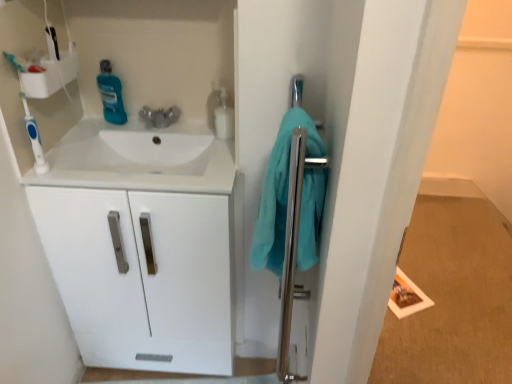
Question: Is blue plastic toothbrush at left wider than teal fabric towel at right?

Choices:
 (A) yes
 (B) no

Answer: (B)

Question: Is blue plastic toothbrush at left oriented away from teal fabric towel at right?

Choices:
 (A) no
 (B) yes

Answer: (A)

Question: Can you confirm if blue plastic toothbrush at left is thinner than teal fabric towel at right?

Choices:
 (A) yes
 (B) no

Answer: (A)

Question: Is blue plastic toothbrush at left positioned beyond the bounds of teal fabric towel at right?

Choices:
 (A) yes
 (B) no

Answer: (A)

Question: Does blue plastic toothbrush at left turn towards teal fabric towel at right?

Choices:
 (A) yes
 (B) no

Answer: (B)

Question: Considering the positions of white glossy sink at upper left and teal glossy mouthwash at upper left, the second cleaning product from the right, in the image, is white glossy sink at upper left bigger or smaller than teal glossy mouthwash at upper left, the second cleaning product from the right,?

Choices:
 (A) small
 (B) big

Answer: (B)

Question: Which is correct: white glossy sink at upper left is inside teal glossy mouthwash at upper left, the second cleaning product from the right, or outside of it?

Choices:
 (A) outside
 (B) inside

Answer: (A)

Question: In the image, is white glossy sink at upper left on the left side or the right side of teal glossy mouthwash at upper left, the 1th cleaning product when ordered from left to right?

Choices:
 (A) right
 (B) left

Answer: (A)

Question: Does point pyautogui.click(x=193, y=157) appear closer or farther from the camera than point pyautogui.click(x=120, y=107)?

Choices:
 (A) farther
 (B) closer

Answer: (B)

Question: Looking at their shapes, would you say teal glossy mouthwash at upper left, the 1th cleaning product when ordered from left to right, is wider or thinner than blue plastic toothbrush at left?

Choices:
 (A) thin
 (B) wide

Answer: (B)

Question: From the image's perspective, relative to blue plastic toothbrush at left, is teal glossy mouthwash at upper left, the 1th cleaning product when ordered from left to right, above or below?

Choices:
 (A) above
 (B) below

Answer: (A)

Question: Considering the relative positions of teal glossy mouthwash at upper left, the second cleaning product from the right, and blue plastic toothbrush at left in the image provided, is teal glossy mouthwash at upper left, the second cleaning product from the right, to the left or to the right of blue plastic toothbrush at left?

Choices:
 (A) right
 (B) left

Answer: (A)

Question: From a real-world perspective, relative to blue plastic toothbrush at left, is teal glossy mouthwash at upper left, the 1th cleaning product when ordered from left to right, vertically above or below?

Choices:
 (A) above
 (B) below

Answer: (B)

Question: From the image's perspective, relative to polished chrome towel bar at right, is white plastic shelf at upper left above or below?

Choices:
 (A) above
 (B) below

Answer: (A)

Question: Do you think white plastic shelf at upper left is within polished chrome towel bar at right, or outside of it?

Choices:
 (A) inside
 (B) outside

Answer: (B)